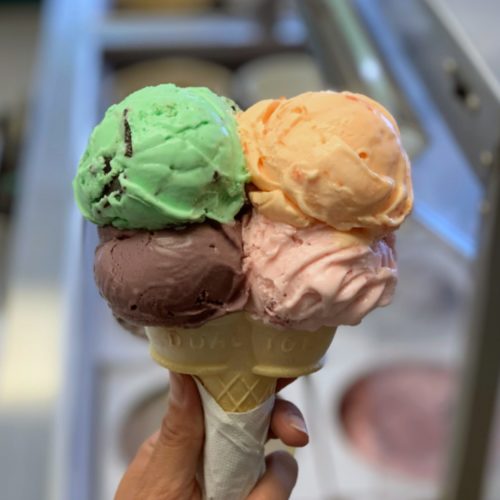
Where is `napkin`? napkin is located at coordinates (217, 447).